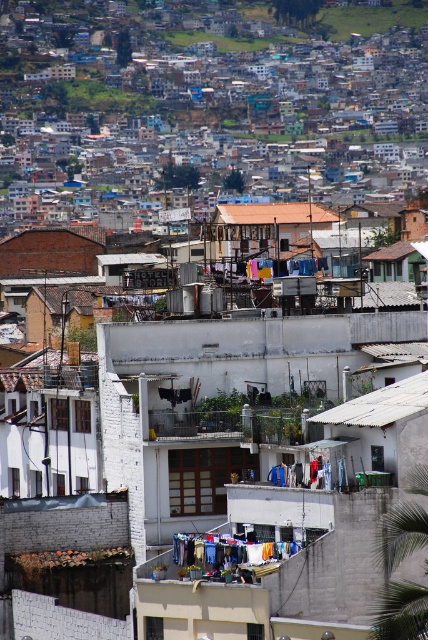
Question: Which point appears farthest from the camera in this image?

Choices:
 (A) (193, 540)
 (B) (421, 400)

Answer: (A)

Question: Which of the following is the closest to the observer?

Choices:
 (A) (234, 547)
 (B) (395, 412)
 (C) (281, 220)

Answer: (B)

Question: Among these points, which one is farthest from the camera?

Choices:
 (A) (416, 408)
 (B) (293, 216)

Answer: (B)

Question: Can you confirm if white corrugated metal roof at center is thinner than blue fabric laundry at center?

Choices:
 (A) yes
 (B) no

Answer: (B)

Question: Does white corrugated metal roof at center come in front of brown tile roof at center?

Choices:
 (A) no
 (B) yes

Answer: (B)

Question: Is the position of white corrugated metal roof at center less distant than that of blue fabric laundry at center?

Choices:
 (A) yes
 (B) no

Answer: (A)